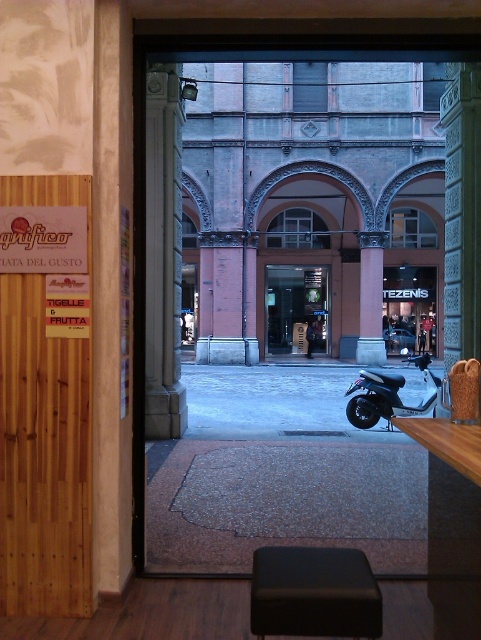
Question: Does wooden sign at left have a smaller size compared to black glass door at center?

Choices:
 (A) yes
 (B) no

Answer: (A)

Question: Which object is closer to the camera taking this photo?

Choices:
 (A) brown stone pillar at center
 (B) shiny black scooter at lower right

Answer: (B)

Question: Which point is farther to the camera?

Choices:
 (A) black glass door at center
 (B) shiny black scooter at lower right

Answer: (A)

Question: From the image, what is the correct spatial relationship of black glass door at center in relation to brown stone pillar at center?

Choices:
 (A) below
 (B) above

Answer: (A)

Question: Can you confirm if black glass door at center is smaller than brown stone pillar at center?

Choices:
 (A) no
 (B) yes

Answer: (A)

Question: Which object is positioned farthest from the brown stone pillar at center?

Choices:
 (A) shiny black scooter at lower right
 (B) wooden sign at left

Answer: (B)